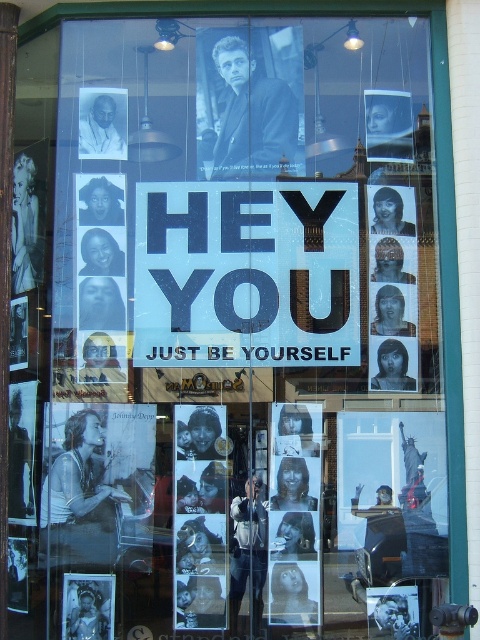
You are an art curator planning to add a new painting to the storefront window display. The new painting is 1.2 meters wide and needs to be placed behind the black matte poster at right without blocking the matte black portrait at upper left. Is this possible?

The black matte poster at right is in front of the matte black portrait at upper left. Since the new painting needs to be placed behind the black matte poster at right, it would also be behind the matte black portrait at upper left. However, the description does not provide information about the depth or space available behind these objects to accommodate the new painting. Therefore, it is unclear if the painting can fit without blocking the matte black portrait at upper left.

You are a window cleaner who needs to clean the storefront window. You have a ladder that allows you to reach the top of the window. When you look at the window, you see the black paper sign at center and the white glossy photo at center. Which object should you clean first if you want to start with the one that is closer to you?

The black paper sign at center is closer to you than the white glossy photo at center, so you should clean the black paper sign at center first.